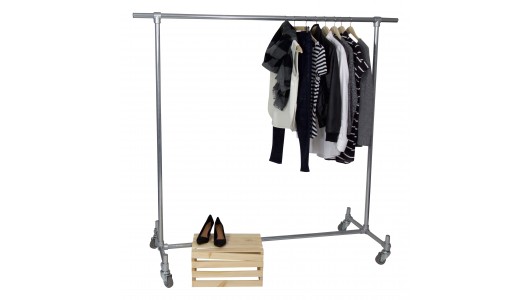
At what (x,y) coordinates should I click in order to perform the action: click on wood slat. Please return your answer as a coordinate pair (x, y). The width and height of the screenshot is (530, 300). Looking at the image, I should click on (209, 282), (209, 273), (212, 263), (225, 254), (254, 233), (260, 237), (251, 242), (259, 248).